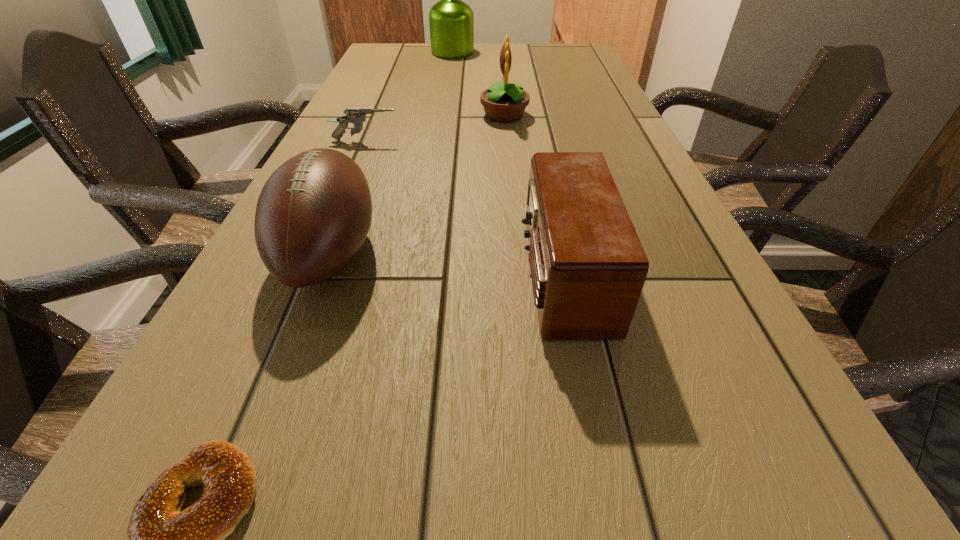
You are a GUI agent. You are given a task and a screenshot of the screen. Output one action in this format:
    pyautogui.click(x=<x>, y=<y>)
    Task: Click on the free space located 0.260m on the face of the fifth nearest object
    
    Given the screenshot: What is the action you would take?
    pyautogui.click(x=382, y=115)

Where is `vacant point located 0.360m on the back of the football (American)`? The width and height of the screenshot is (960, 540). vacant point located 0.360m on the back of the football (American) is located at coordinates (379, 124).

Identify the location of vacant space located 0.100m on the front-facing side of the radio receiver. (463, 274).

Locate an element on the screen. The image size is (960, 540). vacant space located 0.140m on the front-facing side of the radio receiver is located at coordinates 438,274.

I want to click on blank space located on the front-facing side of the radio receiver, so click(x=308, y=274).

I want to click on free point located 0.140m at the barrel of the second shortest object, so click(456, 141).

Locate an element on the screen. object at the far edge is located at coordinates (451, 21).

Image resolution: width=960 pixels, height=540 pixels. What are the coordinates of `football (American) that is at the left edge` in the screenshot? It's located at (314, 212).

Image resolution: width=960 pixels, height=540 pixels. In order to click on gun that is at the left edge in this screenshot , I will do `click(357, 116)`.

Where is `free space at the left edge of the desktop`? free space at the left edge of the desktop is located at coordinates (265, 428).